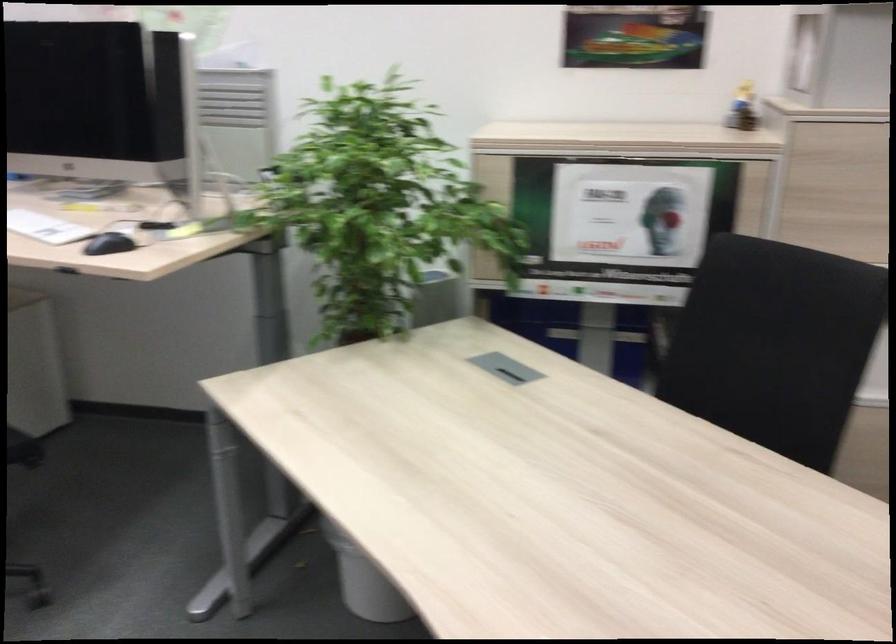
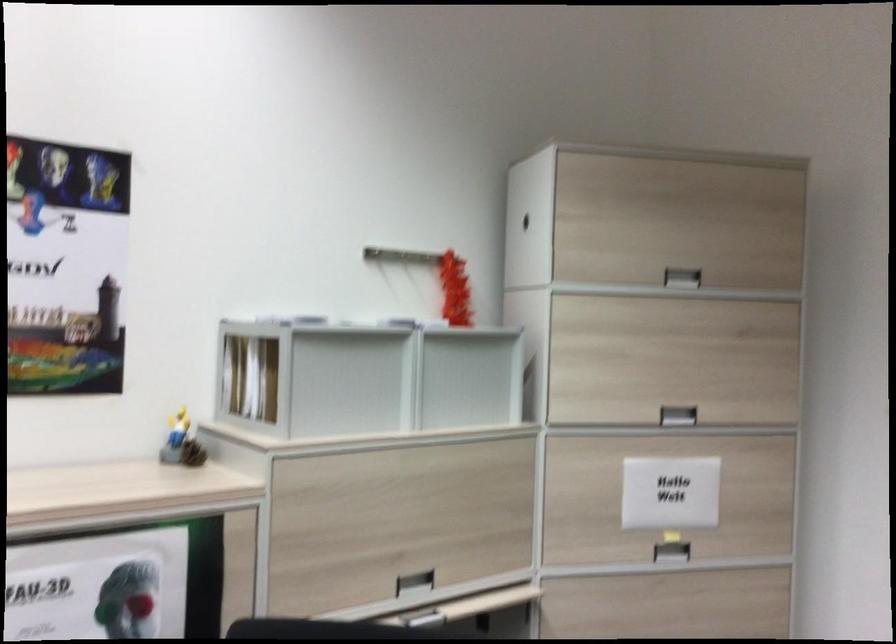
The point at [746,114] is marked in the first image. Where is the corresponding point in the second image?

(192, 453)